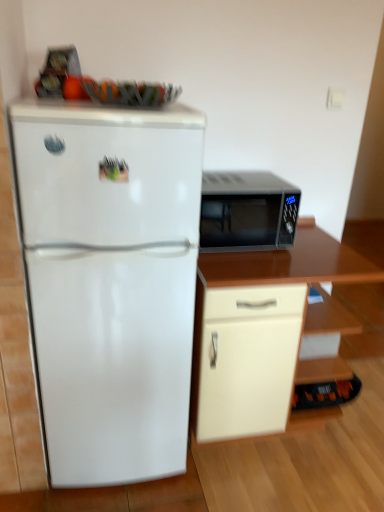
This screenshot has width=384, height=512. What are the coordinates of `free space in front of beige matte cabinet at lower right` in the screenshot? It's located at (284, 481).